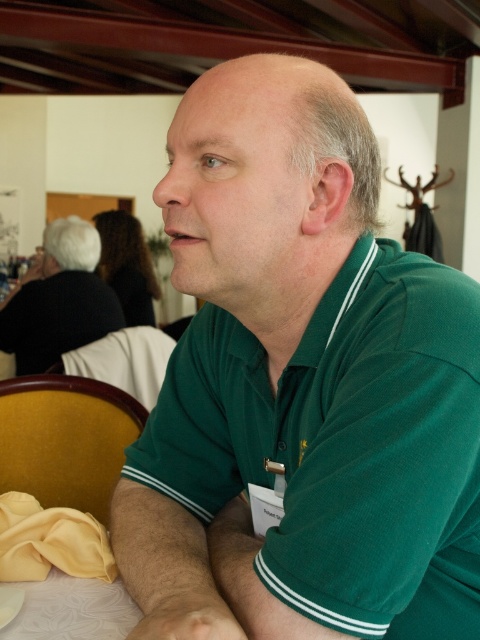
Is point (240, 428) more distant than point (38, 292)?

No, it is not.

Is green smooth shirt at center shorter than green matte shirt at upper right?

Correct, green smooth shirt at center is not as tall as green matte shirt at upper right.

This screenshot has height=640, width=480. What are the coordinates of `green smooth shirt at center` in the screenshot? It's located at tap(301, 387).